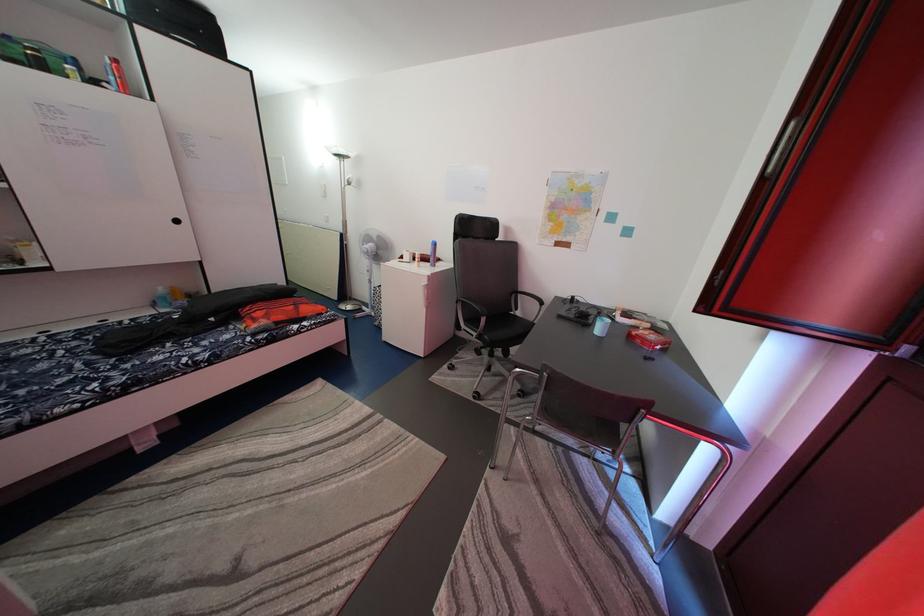
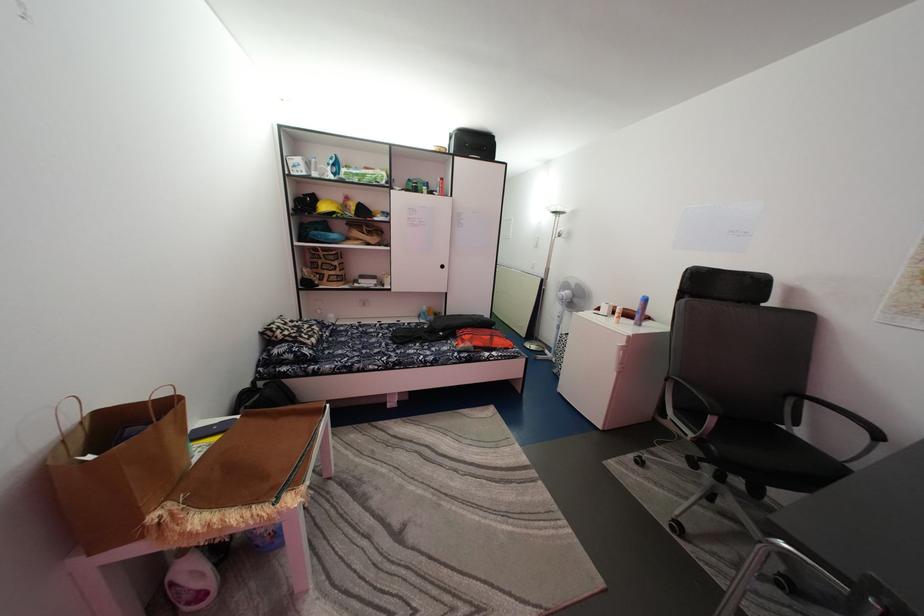
In the second image, find the point that corresponds to point (492, 326) in the first image.

(721, 427)